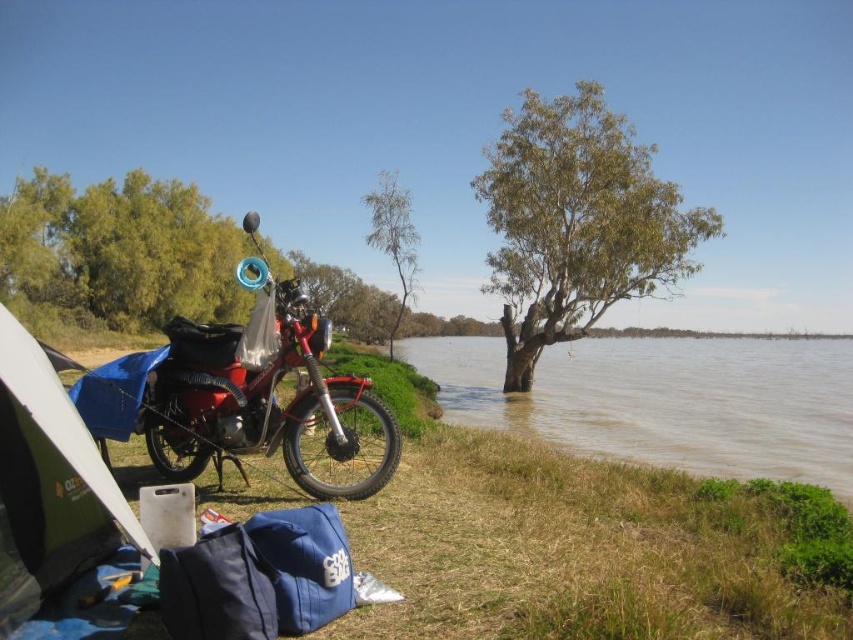
Question: Observing the image, what is the correct spatial positioning of green leafy tree at center in reference to bare wood tree at center?

Choices:
 (A) left
 (B) right

Answer: (B)

Question: Which point is farther from the camera taking this photo?

Choices:
 (A) (769, 355)
 (B) (93, 236)
 (C) (379, 179)
 (D) (76, 502)

Answer: (A)

Question: Among these points, which one is nearest to the camera?

Choices:
 (A) (392, 228)
 (B) (593, 353)
 (C) (61, 461)

Answer: (C)

Question: Is brown muddy water at lower center wider than green leafy tree at center?

Choices:
 (A) yes
 (B) no

Answer: (A)

Question: Considering the real-world distances, which object is closest to the green leafy tree at upper left?

Choices:
 (A) brown muddy water at lower center
 (B) green fabric tent at lower left
 (C) shiny red motorcycle at center

Answer: (C)

Question: Does green leafy tree at center appear over green leafy tree at upper left?

Choices:
 (A) no
 (B) yes

Answer: (B)